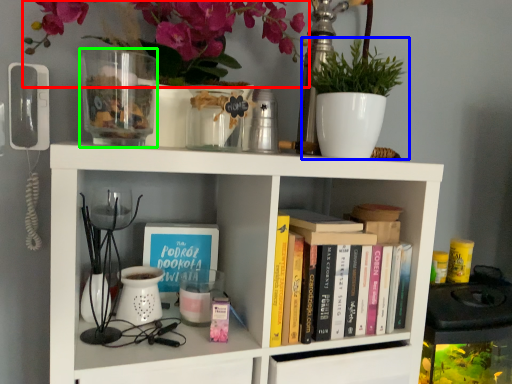
Question: Which object is the farthest from floral arrangement (highlighted by a red box)? Choose among these: houseplant (highlighted by a blue box) or glass vase (highlighted by a green box).

Choices:
 (A) houseplant
 (B) glass vase

Answer: (A)